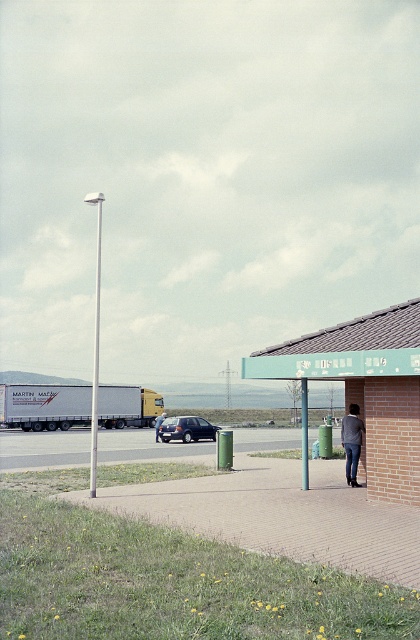
Question: Considering the relative positions of teal painted metal bus stop at center and dark blue metallic hatchback at center in the image provided, where is teal painted metal bus stop at center located with respect to dark blue metallic hatchback at center?

Choices:
 (A) right
 (B) left

Answer: (A)

Question: Is brick pavement at center closer to camera compared to smooth concrete pavement at center?

Choices:
 (A) no
 (B) yes

Answer: (B)

Question: Which point appears farthest from the camera in this image?

Choices:
 (A) (199, 435)
 (B) (231, 499)

Answer: (A)

Question: Can you confirm if teal painted metal bus stop at center is smaller than smooth concrete pavement at center?

Choices:
 (A) no
 (B) yes

Answer: (B)

Question: Which point appears farthest from the camera in this image?

Choices:
 (A) (194, 422)
 (B) (349, 432)
 (C) (117, 397)
 (D) (346, 332)

Answer: (C)

Question: Considering the real-world distances, which object is closest to the gray sweater at center?

Choices:
 (A) light blue jeans at center
 (B) white matte trailer truck at left
 (C) brick pavement at center

Answer: (C)